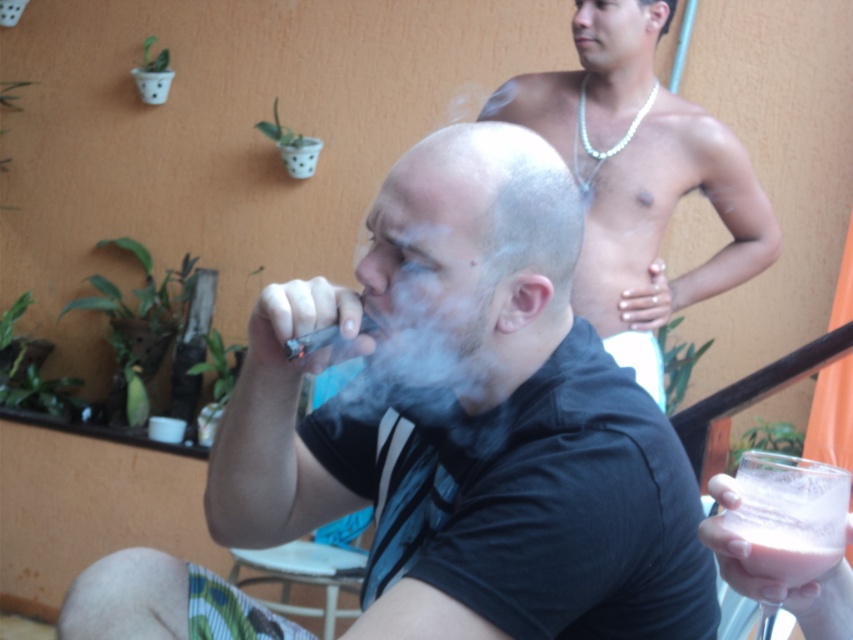
You are a photographer trying to capture the scene. The gray matte head at center is at point 0.409, 0.552. If you want to position the head at the center of the frame, which is at point 0.5, 0.5, should you move the camera slightly to the right or left?

The gray matte head at center is at point [469,260]. To center it at [426,320], move the camera slightly to the right to adjust the horizontal position and slightly upward to adjust the vertical position.

In the scene shown: You are a photographer trying to capture the scene. The gray matte head at center and the white vapor at center are both in your frame. Which object is positioned higher in the image?

The gray matte head at center is positioned higher than the white vapor at center in the image.

You are a photographer trying to capture the scene. You want to ensure that the gray matte head at center and the white vapor at center are both clearly visible in your photo. Given their sizes, which object should you focus on to ensure both are in focus?

The gray matte head at center is bigger than the white vapor at center, so focusing on the larger gray matte head at center will help ensure both are in focus since it has more detail to lock onto.